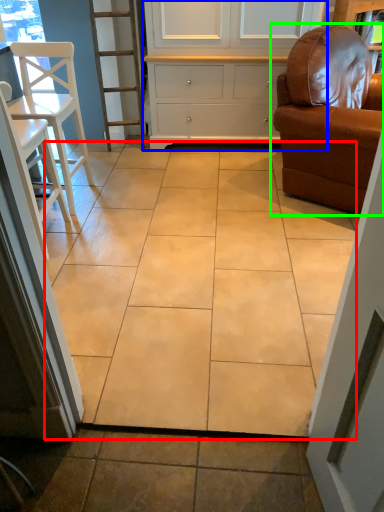
Question: Considering the real-world distances, which object is farthest from ceramic tile (highlighted by a red box)? cabinetry (highlighted by a blue box) or chair (highlighted by a green box)?

Choices:
 (A) cabinetry
 (B) chair

Answer: (A)